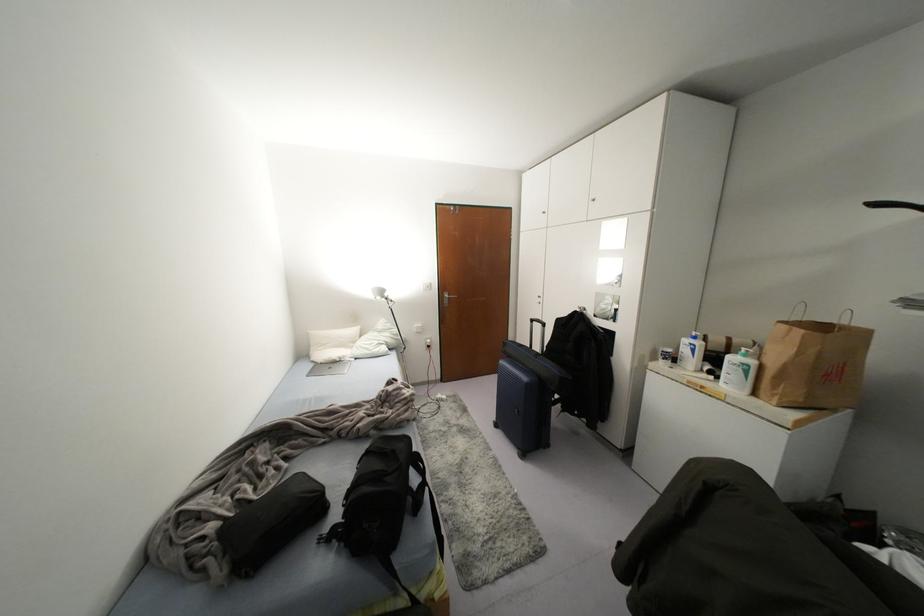
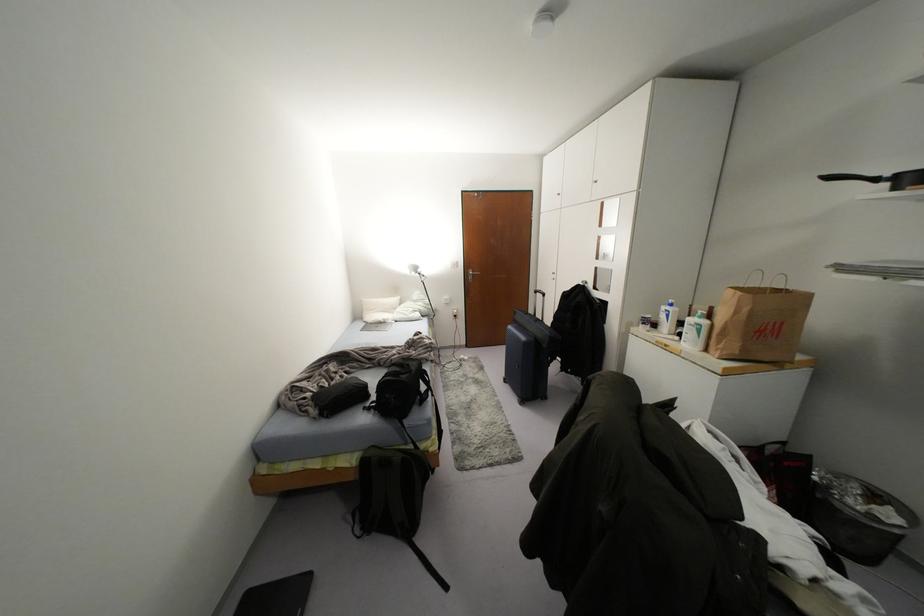
In the second image, find the point that corresponds to (542,323) in the first image.

(542, 294)